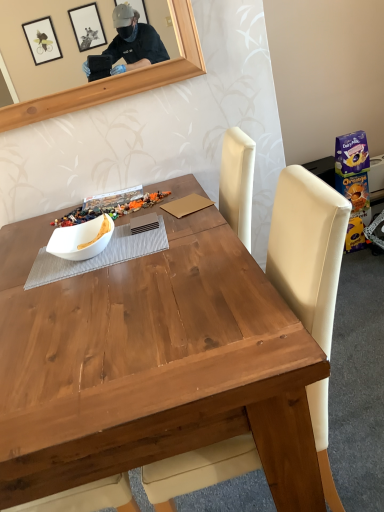
Question: From a real-world perspective, is white matte bowl at center on wooden chair at center?

Choices:
 (A) yes
 (B) no

Answer: (A)

Question: Considering the relative sizes of white matte bowl at center and wooden chair at center in the image provided, is white matte bowl at center shorter than wooden chair at center?

Choices:
 (A) yes
 (B) no

Answer: (A)

Question: From the image's perspective, does white matte bowl at center appear higher than wooden chair at center?

Choices:
 (A) yes
 (B) no

Answer: (A)

Question: Is white matte bowl at center looking in the opposite direction of wooden chair at center?

Choices:
 (A) yes
 (B) no

Answer: (B)

Question: Is white matte bowl at center at the left side of wooden chair at center?

Choices:
 (A) no
 (B) yes

Answer: (B)

Question: Considering the relative positions of white matte bowl at center and wooden chair at center in the image provided, is white matte bowl at center to the right of wooden chair at center from the viewer's perspective?

Choices:
 (A) yes
 (B) no

Answer: (B)

Question: Is wooden chair at center looking in the opposite direction of white matte bowl at center?

Choices:
 (A) yes
 (B) no

Answer: (B)

Question: Considering the relative positions of wooden chair at center and white matte bowl at center in the image provided, is wooden chair at center to the left of white matte bowl at center from the viewer's perspective?

Choices:
 (A) yes
 (B) no

Answer: (B)

Question: Is wooden chair at center thinner than white matte bowl at center?

Choices:
 (A) yes
 (B) no

Answer: (B)

Question: From a real-world perspective, is wooden chair at center beneath white matte bowl at center?

Choices:
 (A) yes
 (B) no

Answer: (A)

Question: Considering the relative sizes of wooden chair at center and white matte bowl at center in the image provided, is wooden chair at center taller than white matte bowl at center?

Choices:
 (A) no
 (B) yes

Answer: (B)

Question: Is wooden chair at center at the right side of white matte bowl at center?

Choices:
 (A) no
 (B) yes

Answer: (B)

Question: Is white matte bowl at center not close to wooden chair at center?

Choices:
 (A) yes
 (B) no

Answer: (B)